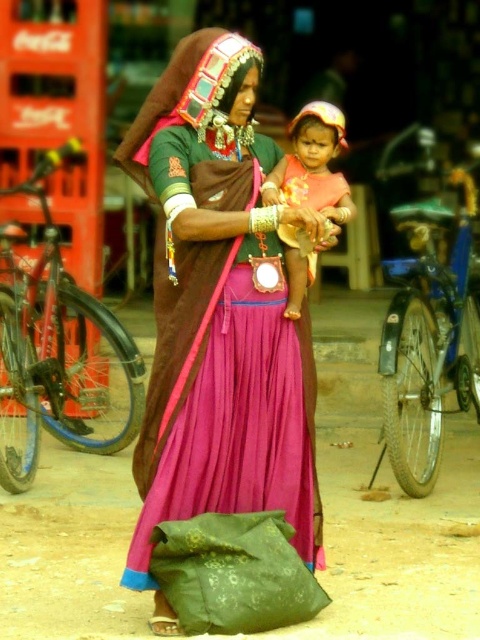
Who is more distant from viewer, (317, 544) or (300, 259)?

Point (300, 259)

Does pink satin saree at center have a lesser width compared to matte pink fabric at center?

In fact, pink satin saree at center might be wider than matte pink fabric at center.

This screenshot has height=640, width=480. What do you see at coordinates (219, 312) in the screenshot?
I see `pink satin saree at center` at bounding box center [219, 312].

Find the location of a particular element. The height and width of the screenshot is (640, 480). pink satin saree at center is located at coordinates (219, 312).